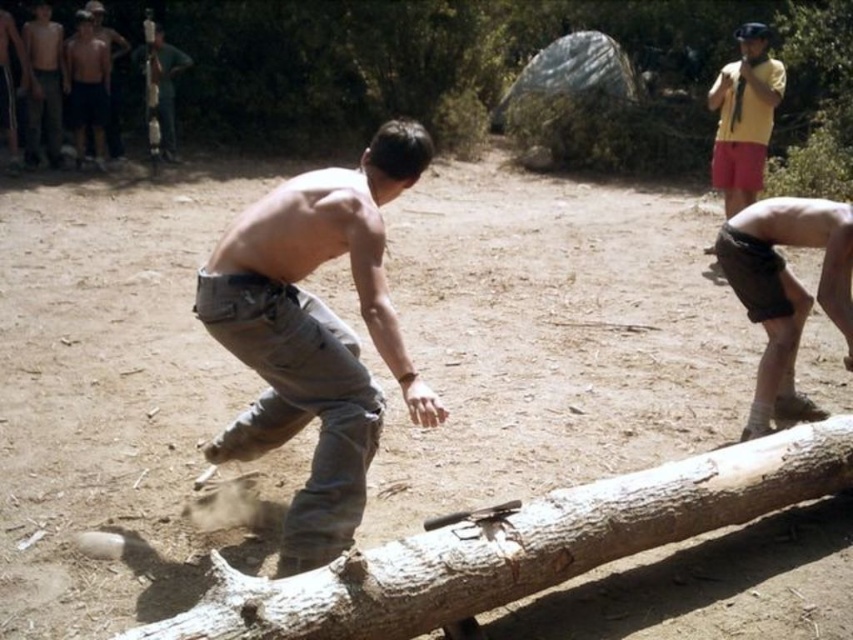
What do you see at coordinates (44, 84) in the screenshot? I see `shiny metallic shirt at upper left` at bounding box center [44, 84].

I want to click on shiny metallic shirt at upper left, so click(x=44, y=84).

Locate an element on the screen. This screenshot has height=640, width=853. shiny metallic shirt at upper left is located at coordinates (44, 84).

Does tan cotton pants at center have a greater height compared to smooth wooden pole at upper left?

No.

Does point (279, 204) come in front of point (173, 56)?

Yes, it is.

Locate an element on the screen. This screenshot has height=640, width=853. tan cotton pants at center is located at coordinates (315, 333).

Does tan cotton pants at center appear on the right side of matte black shirt at upper left?

Yes, tan cotton pants at center is to the right of matte black shirt at upper left.

Is tan cotton pants at center bigger than matte black shirt at upper left?

Yes, tan cotton pants at center is bigger than matte black shirt at upper left.

Is point (323, 328) less distant than point (74, 157)?

Yes, point (323, 328) is closer to viewer.

The image size is (853, 640). What are the coordinates of `tan cotton pants at center` in the screenshot? It's located at (315, 333).